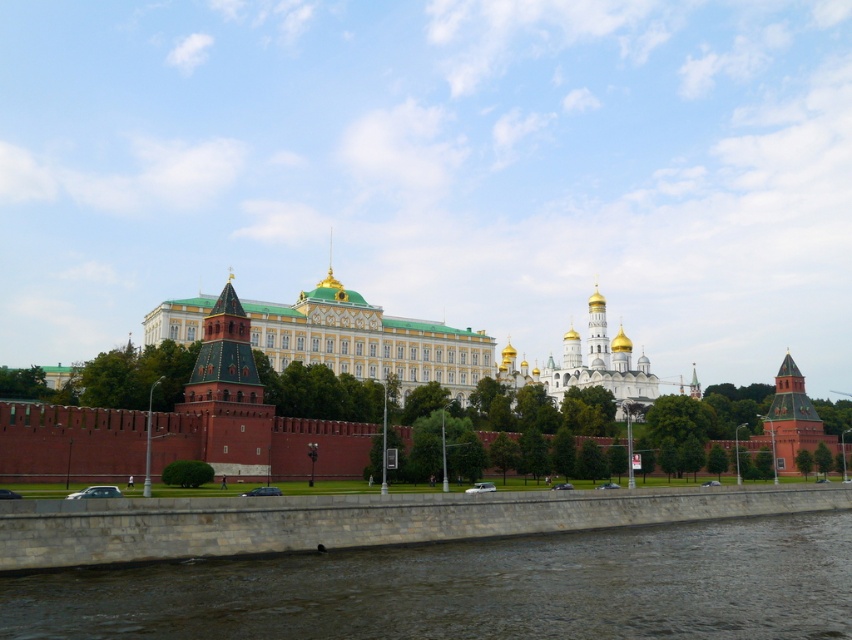
You are standing at the point marked as point (471, 588) in the image. What is the nearest object to you in the scene?

The nearest object to you is the brown stone river at lower center located at point (471, 588).

You are standing at the Kremlin embankment and want to visit the point marked at coordinates (213, 509). If you walk straight ahead, will you reach that point before walking 200 feet?

The distance between you and the point marked at coordinates (213, 509) is 199.28 feet, which is less than 200 feet. Therefore, you will reach the point before walking 200 feet.